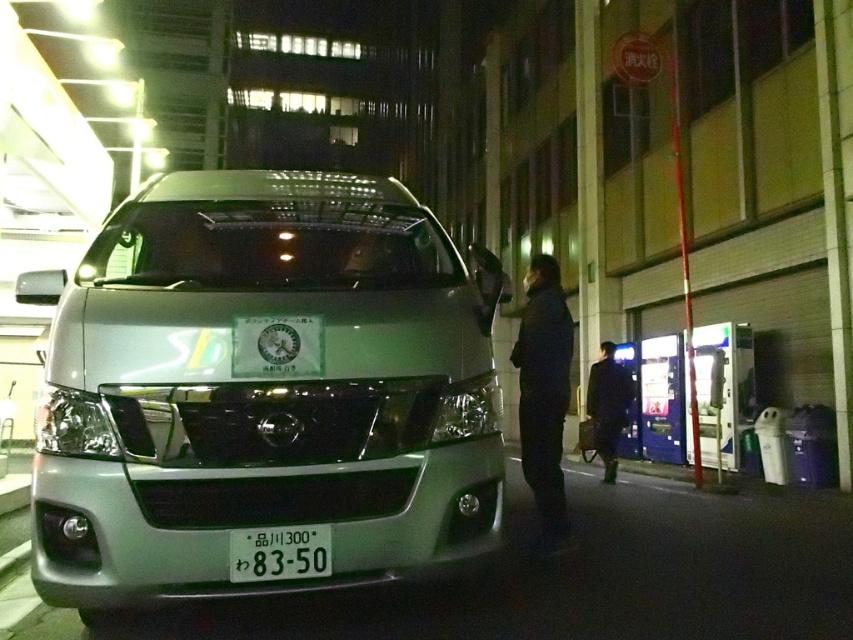
You are standing in front of the silver van parked on the street. There are two points marked on the van. One is at coordinate point (245, 170) and the other is at coordinate point (238, 563). Which point is closer to you?

Point (245, 170) is further to the camera than point (238, 563), so the point closer to you is point (238, 563).

You are a delivery driver who needs to park your satin silver van at center in a specific spot marked at coordinates 0.609, 0.308. Can you confirm if the van is already parked correctly based on its current position?

The satin silver van at center is located exactly at point (262, 388), so it is parked correctly in the specified spot.